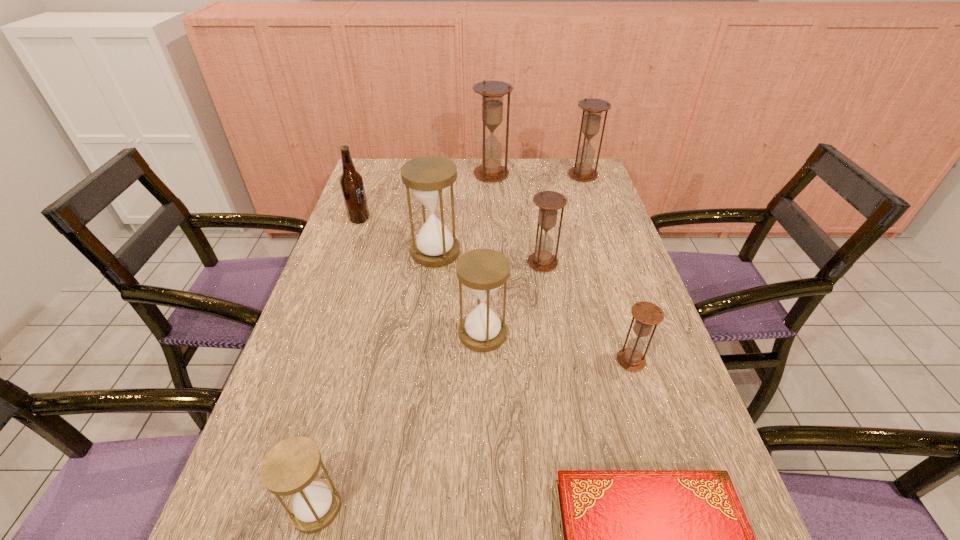
Identify the location of vacant space located 0.260m on the front of the nearest brown hourglass. The height and width of the screenshot is (540, 960). (672, 494).

Locate an element on the screen. vacant space situated 0.280m on the back of the leftmost hourglass is located at coordinates (355, 358).

You are a GUI agent. You are given a task and a screenshot of the screen. Output one action in this format:
    pyautogui.click(x=<x>, y=<y>)
    Task: Click on the beer bottle located at the left edge
    
    Given the screenshot: What is the action you would take?
    coord(351,182)

Where is `hourglass that is at the left edge`? hourglass that is at the left edge is located at coordinates (290, 467).

The width and height of the screenshot is (960, 540). I want to click on object situated at the far right corner, so click(592, 108).

This screenshot has height=540, width=960. I want to click on vacant space at the far edge, so click(x=475, y=181).

Where is `free space at the left edge`? This screenshot has height=540, width=960. free space at the left edge is located at coordinates (331, 267).

Locate an element on the screen. The height and width of the screenshot is (540, 960). free spot at the right edge of the desktop is located at coordinates coord(647,338).

The height and width of the screenshot is (540, 960). I want to click on free space between the leftmost hourglass and the third smallest brown hourglass, so click(449, 341).

Where is `empty location between the second hourglass from left to right and the second biggest brown hourglass`? empty location between the second hourglass from left to right and the second biggest brown hourglass is located at coordinates (509, 214).